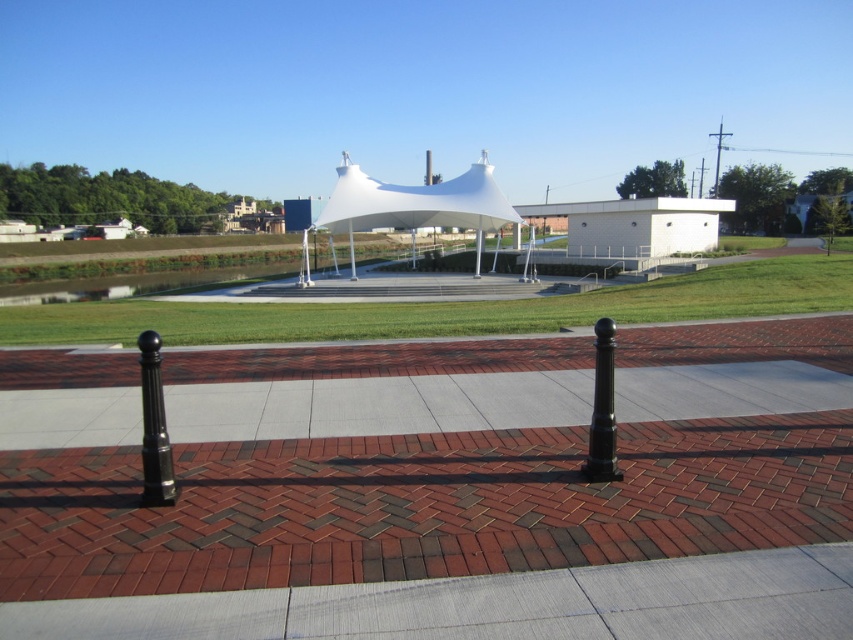
You are a delivery person trying to place a heavy box on the gray concrete pavement at center. However, there is a black polished post at center in the way. Can you place the box on the pavement without moving the post?

→ The gray concrete pavement at center has a lesser height compared to the black polished post at center, so the box can be placed on the pavement as the post is elevated and does not obstruct the surface.

You are standing in the park and see the white fabric tent at center. If you walk straight ahead, will you reach the tent before the paved area ends? The paved area extends 50 meters from where you are standing.

The white fabric tent at center is 45.18 meters away from viewer, which is less than the 50 meters length of the paved area. Therefore, you will reach the tent before the paved area ends.

You are planning to install a new light fixture between the black polished metal post at left and the black polished post at center. Based on their positions, where should the light fixture be placed relative to the two posts?

The black polished metal post at left is above the black polished post at center, so the light fixture should be placed below the black polished metal post at left and above the black polished post at center to maintain alignment between them.